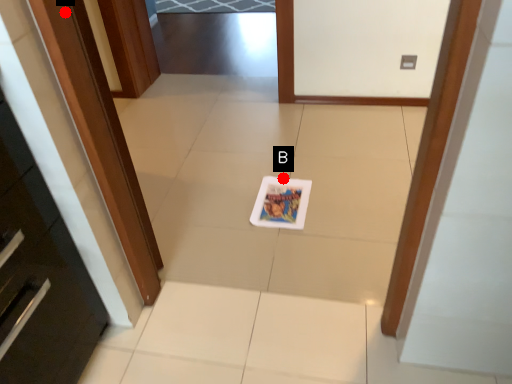
Question: Two points are circled on the image, labeled by A and B beside each circle. Which of the following is the farthest from the observer?

Choices:
 (A) A is further
 (B) B is further

Answer: (B)